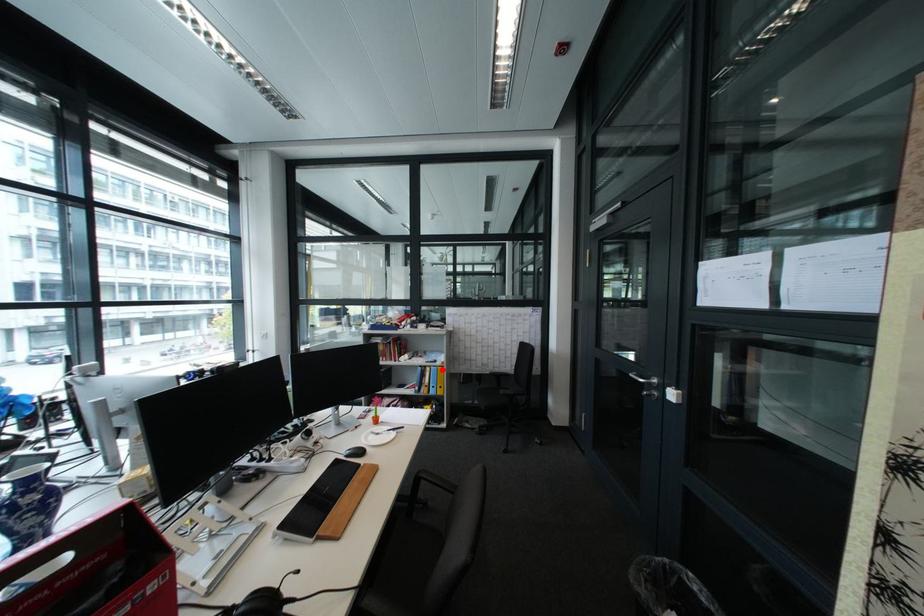
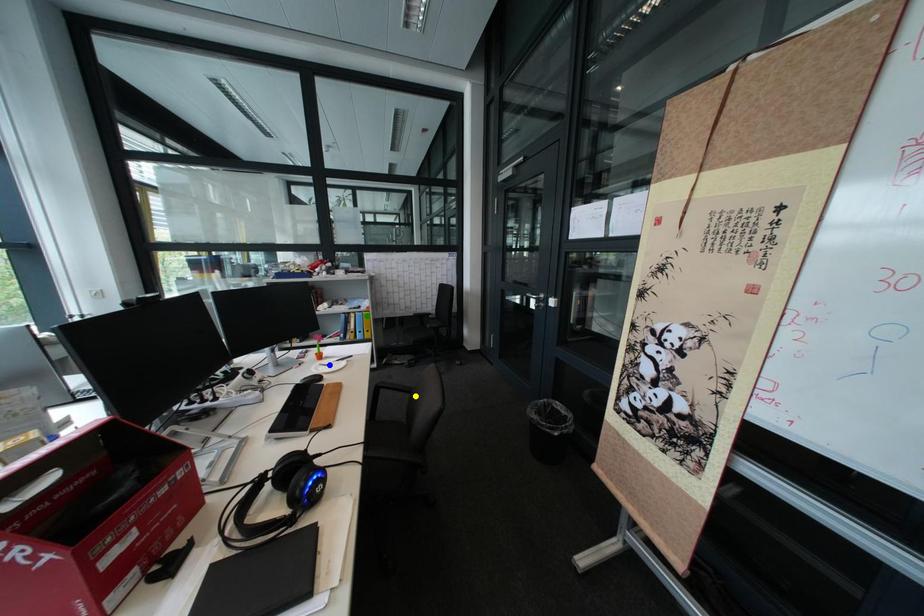
Question: I am providing you with two images of the same scene from different viewpoints. A red point is marked on the first image. You are given multiple points on the second image. Which point in image 2 is actually the same real-world point as the red point in image 1?

Choices:
 (A) green point
 (B) blue point
 (C) yellow point

Answer: (A)